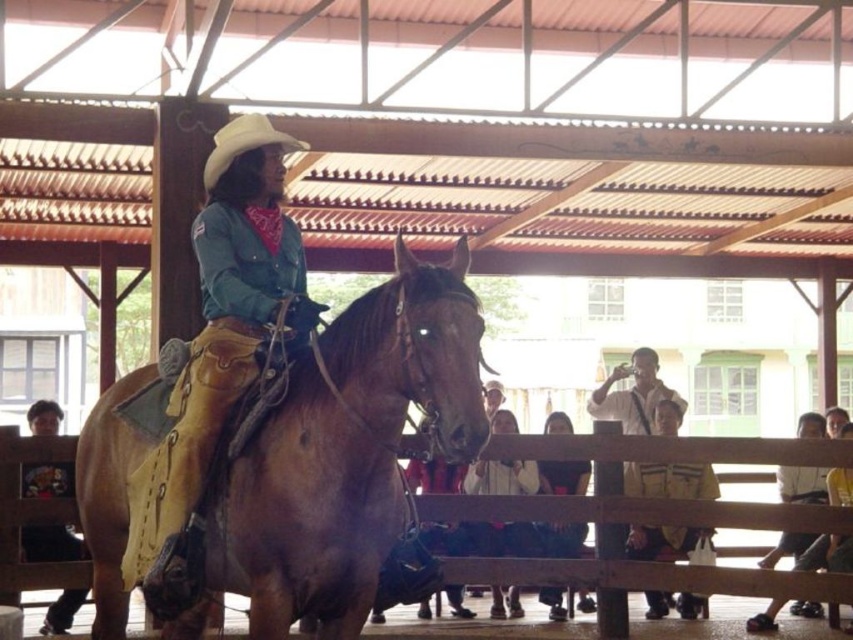
Can you confirm if matte brown leather cowboy hat at upper center is bigger than matte brown leather jacket at lower left?

Indeed, matte brown leather cowboy hat at upper center has a larger size compared to matte brown leather jacket at lower left.

How much distance is there between matte brown leather cowboy hat at upper center and matte brown leather jacket at lower left?

matte brown leather cowboy hat at upper center and matte brown leather jacket at lower left are 3.99 meters apart.

Which is behind, point (189, 481) or point (32, 404)?

The point (32, 404) is more distant.

This screenshot has width=853, height=640. In order to click on matte brown leather cowboy hat at upper center in this screenshot , I will do `click(223, 323)`.

Can you confirm if matte brown leather jacket at lower left is shorter than white cotton shirt at center?

Correct, matte brown leather jacket at lower left is not as tall as white cotton shirt at center.

How much distance is there between matte brown leather jacket at lower left and white cotton shirt at center?

matte brown leather jacket at lower left is 3.43 meters from white cotton shirt at center.

Between point (48, 625) and point (492, 609), which one is positioned in front?

Positioned in front is point (48, 625).

Image resolution: width=853 pixels, height=640 pixels. Identify the location of matte brown leather jacket at lower left. (51, 544).

At what (x,y) coordinates should I click in order to perform the action: click on brown leather horse at center. Please return your answer as a coordinate pair (x, y). Looking at the image, I should click on (347, 451).

Which is behind, point (302, 417) or point (270, 326)?

The point (270, 326) is behind.

Is point (459, 365) farther from camera compared to point (199, 234)?

No, it is not.

Image resolution: width=853 pixels, height=640 pixels. Identify the location of brown leather horse at center. (347, 451).